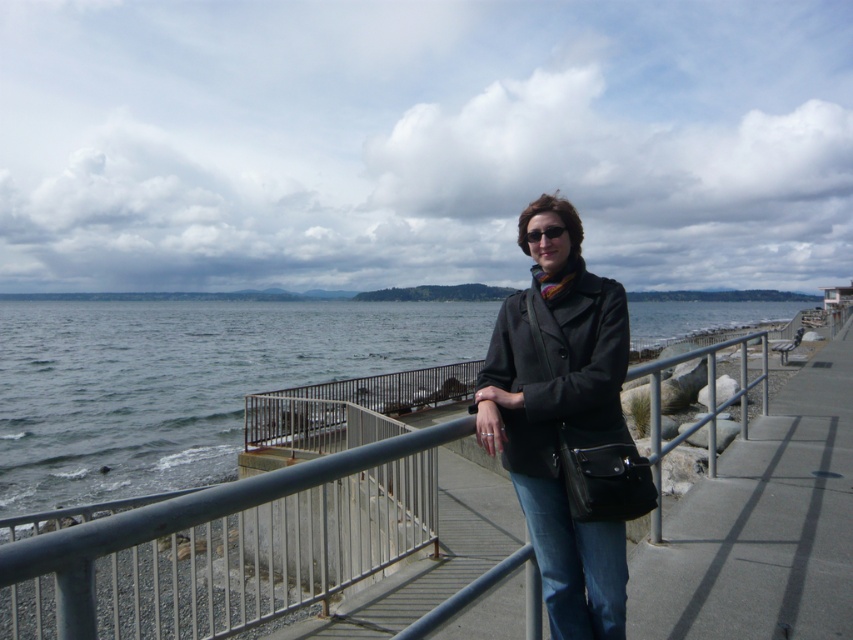
You are a photographer positioned at the edge of the walkway. You want to capture both the matte black coat at center and the denim at center in your shot. Which object should you focus on first to ensure both are in clear view?

You should focus on the matte black coat at center first since it is closer to you than the denim at center, ensuring both will be in clear view when focused properly.

Looking at this image, you are a tailor measuring the distance between the matte black coat at center and the denim at center to ensure proper alterations. Can the coat be altered to fit over the denim without overlapping more than 8 inches?

The matte black coat at center is 7.42 inches away from denim at center, so yes, the coat can be altered to fit over the denim without overlapping more than 8 inches since the distance is within the limit.

You are a fashion designer observing a person dressed in a black matte coat at center and denim at center. Which clothing item is wider?

The black matte coat at center is wider than denim at center.